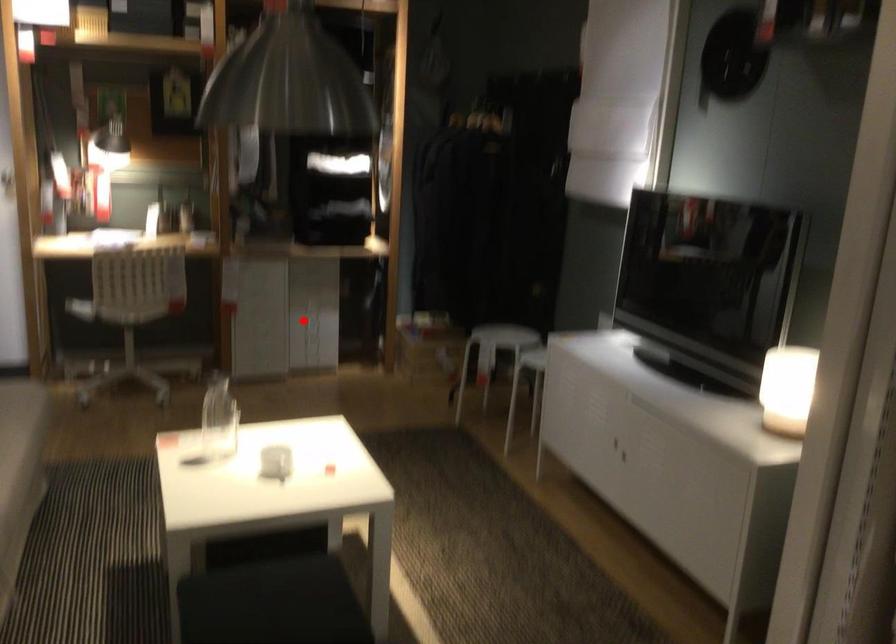
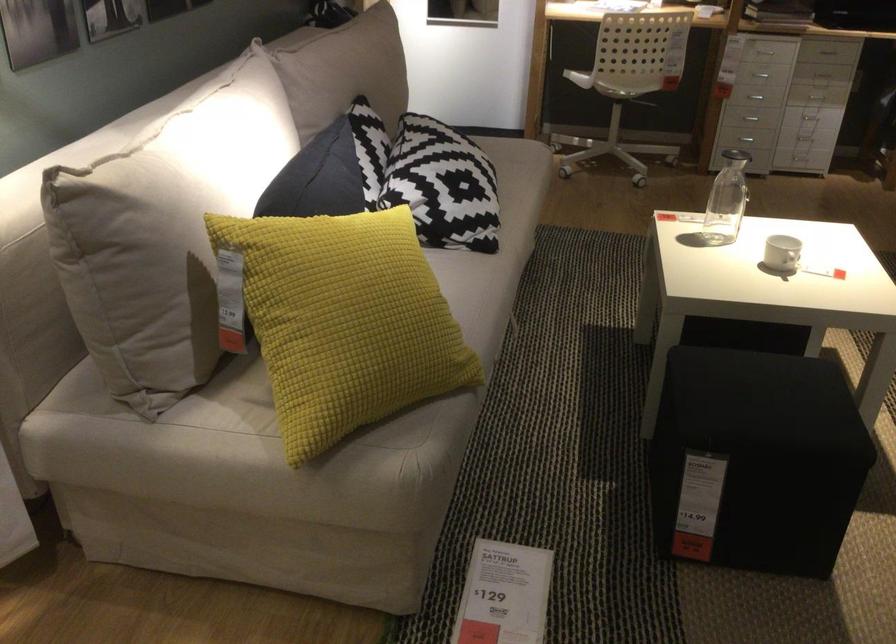
Question: I am providing you with two images of the same scene from different viewpoints. In image1, a red point is highlighted. Considering the same 3D point in image2, which of the following is correct?

Choices:
 (A) It is closer
 (B) It is farther

Answer: (A)